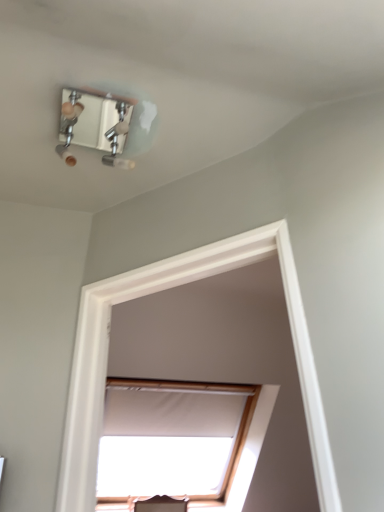
The image size is (384, 512). What do you see at coordinates (201, 392) in the screenshot?
I see `white fabric window at upper center` at bounding box center [201, 392].

Identify the location of white fabric window at upper center. (201, 392).

In order to face white fabric window at upper center, should I rotate leftwards or rightwards?

A 0.562 degree turn to the left will do.

What are the coordinates of `white fabric window at upper center` in the screenshot? It's located at pos(201,392).